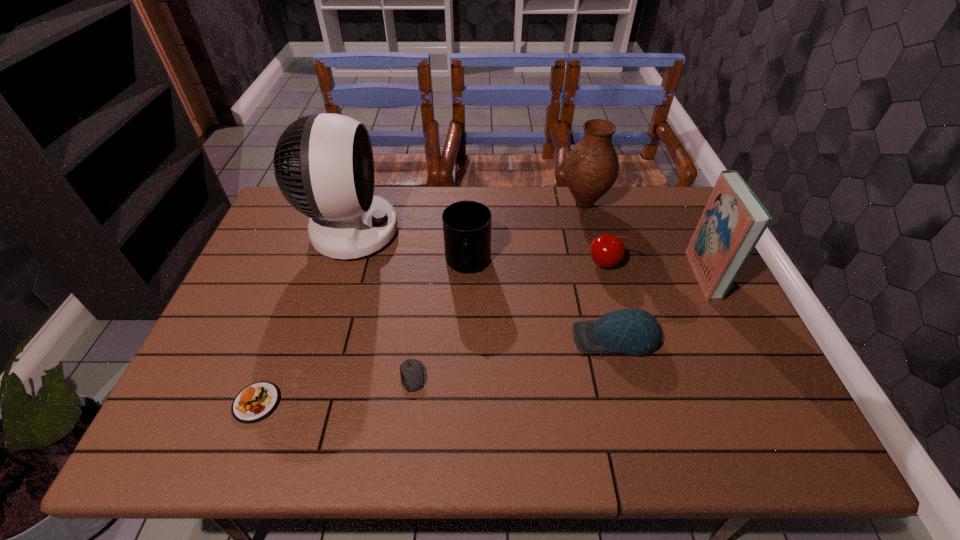
Locate an element on the screen. The image size is (960, 540). the third object from left to right is located at coordinates (412, 376).

The width and height of the screenshot is (960, 540). Identify the location of vacant position located on the grille of the tallest object. pos(522,232).

You are a GUI agent. You are given a task and a screenshot of the screen. Output one action in this format:
    pyautogui.click(x=<x>, y=<y>)
    Task: Click on the vacant space located on the right of the vase
    
    Given the screenshot: What is the action you would take?
    pyautogui.click(x=630, y=205)

Find the location of a particular element. Image resolution: width=960 pixels, height=540 pixels. vacant space located 0.310m on the cover of the rightmost object is located at coordinates (585, 274).

This screenshot has width=960, height=540. In order to click on free space located 0.250m on the cover of the rightmost object in this screenshot , I will do tap(606, 274).

Locate an element on the screen. The width and height of the screenshot is (960, 540). free space located 0.090m on the cover of the rightmost object is located at coordinates (662, 274).

The height and width of the screenshot is (540, 960). What are the coordinates of `vacant space situated 0.200m on the side of the fourth object from left to right with the handle` in the screenshot? It's located at click(466, 346).

Image resolution: width=960 pixels, height=540 pixels. Identify the location of blank space located 0.270m on the front of the fourth shortest object. (632, 355).

Locate an element on the screen. vacant space situated 0.200m on the right of the baseball cap is located at coordinates (739, 338).

You are a GUI agent. You are given a task and a screenshot of the screen. Output one action in this format:
    pyautogui.click(x=<x>, y=<y>)
    Task: Click on the free space located on the back of the seventh tallest object
    This screenshot has height=540, width=960.
    Given the screenshot: What is the action you would take?
    pyautogui.click(x=306, y=274)